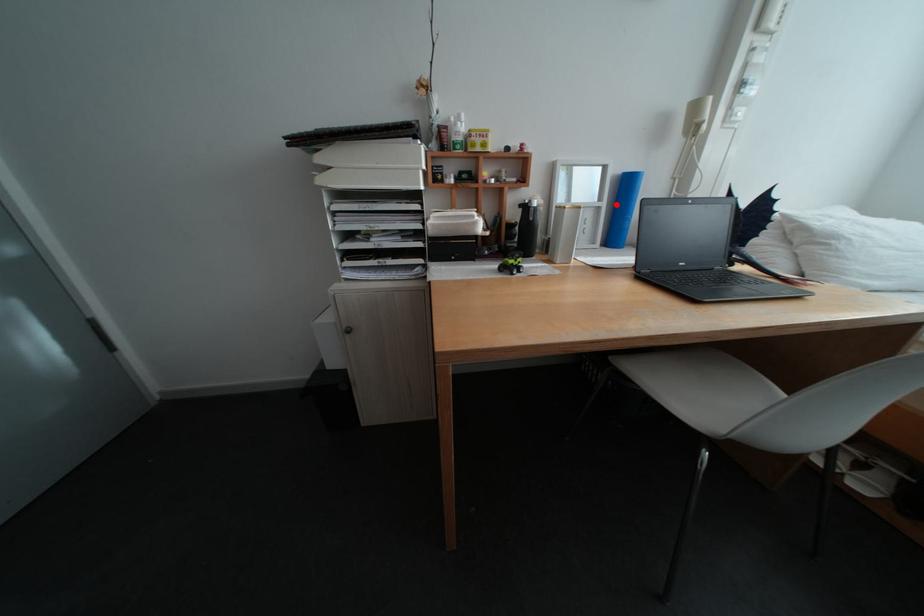
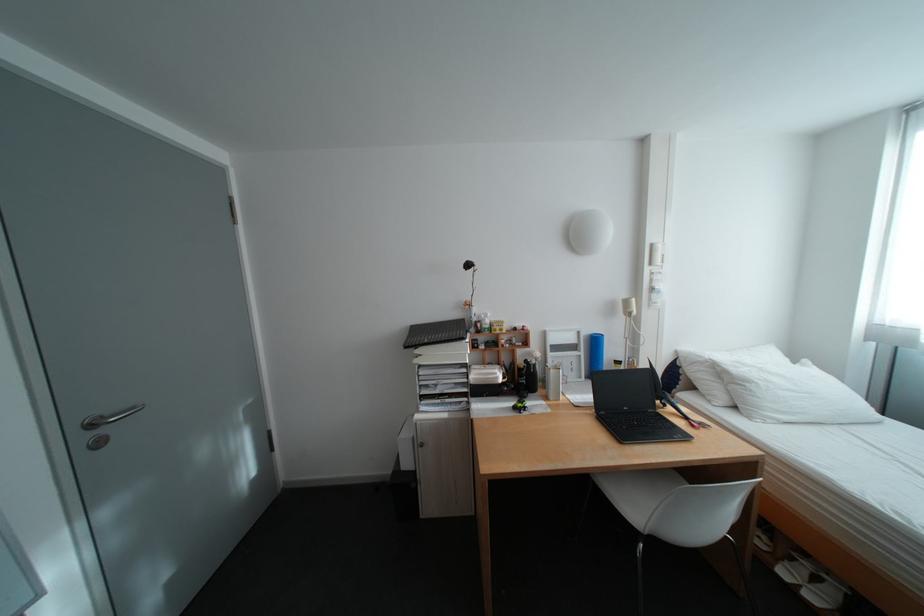
Locate, in the second image, the point that corresponds to the highlighted location in the first image.

(594, 354)